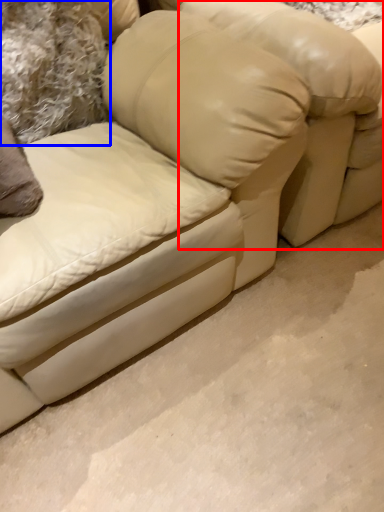
Question: Which object is further to the camera taking this photo, bean bag chair (highlighted by a red box) or pillow (highlighted by a blue box)?

Choices:
 (A) bean bag chair
 (B) pillow

Answer: (B)